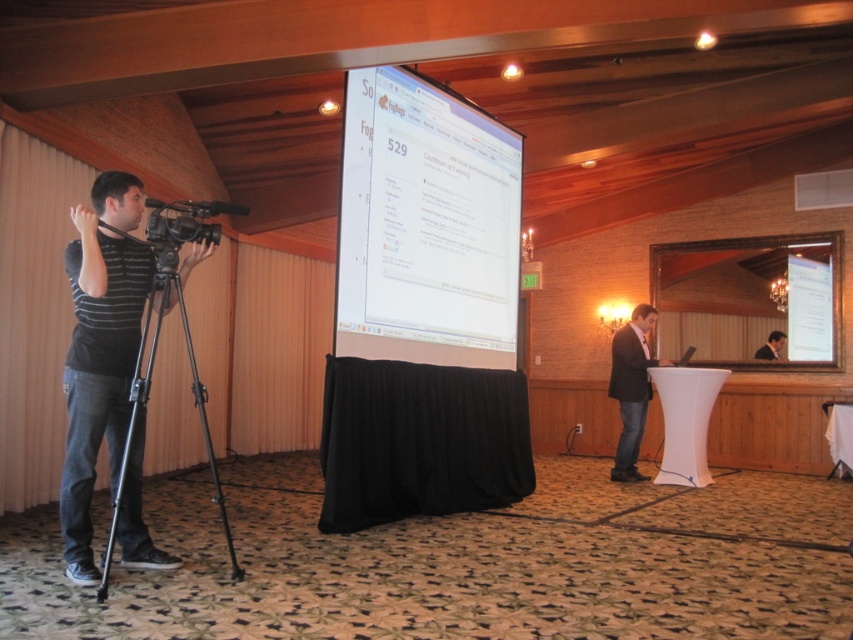
You are a photographer in the conference room and need to capture both the dark gray suit at center and the smooth skin face at center in a single photo. Based on their positions, which one should you focus on first to ensure both are in frame?

Since the dark gray suit at center is to the left of the smooth skin face at center, you should focus on the dark gray suit at center first as it is positioned further left, allowing you to adjust the camera to include both subjects in the frame.

Based on the photo, you are setting up a video camera for a presentation in this conference room. The black matte tripod at left and the matte black video camera at left need to be positioned properly. Based on their current arrangement, which object is closer to the floor?

The black matte tripod at left is located below the matte black video camera at left, so the black matte tripod at left is closer to the floor.

You are standing in the conference room and want to take a photo of the point at coordinates (142, 378). The camera you have can only focus on objects within 3 meters. Will you be able to take a clear photo of that point?

The point at coordinates (142, 378) is 3.11 meters away from the viewer, which is slightly beyond the camera focus range of 3 meters. Therefore, the photo may not be clear.